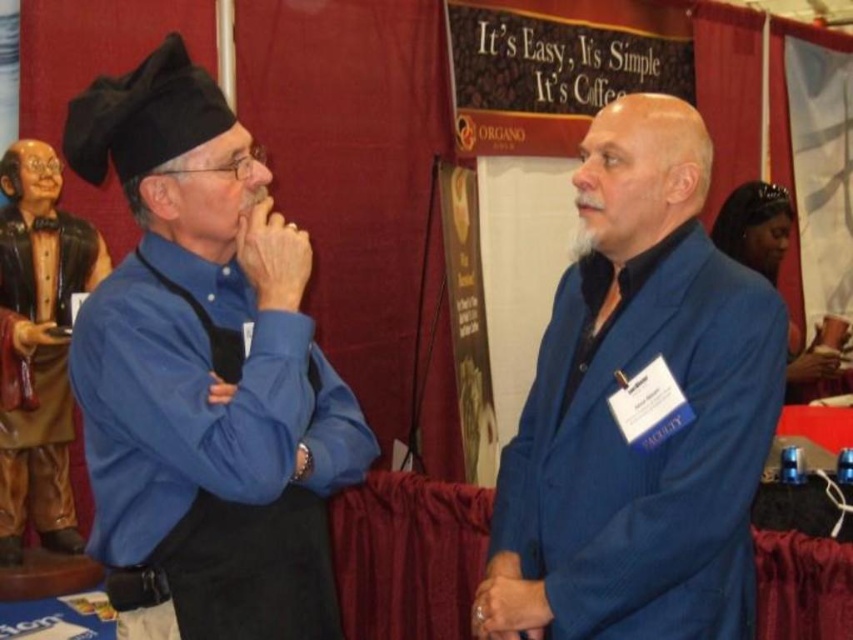
Is blue woolen suit at right positioned behind brown leather robe at left?

No, blue woolen suit at right is in front of brown leather robe at left.

Measure the distance between point (x=525, y=416) and camera.

The distance of point (x=525, y=416) from camera is 5.80 feet.

Find the location of a particular element. blue woolen suit at right is located at coordinates (646, 449).

Which is more to the left, matte black hat at left or blue woolen suit at right?

matte black hat at left

What do you see at coordinates (204, 376) in the screenshot? Image resolution: width=853 pixels, height=640 pixels. I see `matte black hat at left` at bounding box center [204, 376].

Who is more forward, (144,332) or (659,305)?

Point (144,332) is in front.

This screenshot has width=853, height=640. What are the coordinates of `matte black hat at left` in the screenshot? It's located at (204, 376).

I want to click on matte black hat at left, so click(204, 376).

Is matte black hat at left positioned before brown leather robe at left?

Yes, matte black hat at left is closer to the viewer.

Is point (109, 80) more distant than point (62, 472)?

No.

Locate an element on the screen. matte black hat at left is located at coordinates (204, 376).